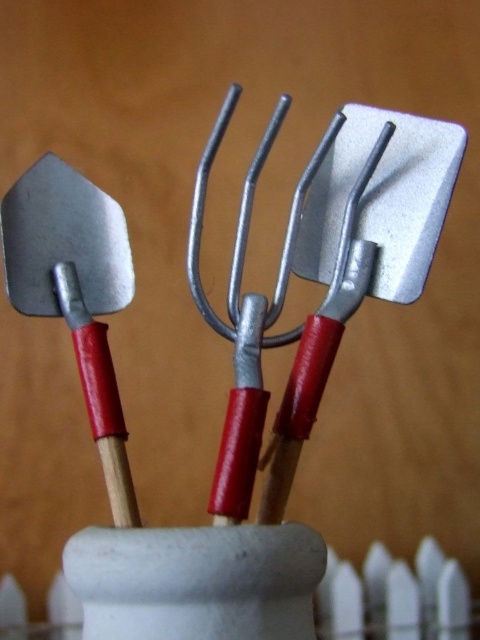
Can you confirm if metallic silver spatula at center is wider than matte silver shovel at left?

Correct, the width of metallic silver spatula at center exceeds that of matte silver shovel at left.

Can you confirm if metallic silver spatula at center is positioned to the left of matte silver shovel at left?

In fact, metallic silver spatula at center is to the right of matte silver shovel at left.

Which is in front, point (437, 177) or point (4, 196)?

Point (437, 177) is in front.

Where is `metallic silver spatula at center`? This screenshot has width=480, height=640. metallic silver spatula at center is located at coordinates (360, 252).